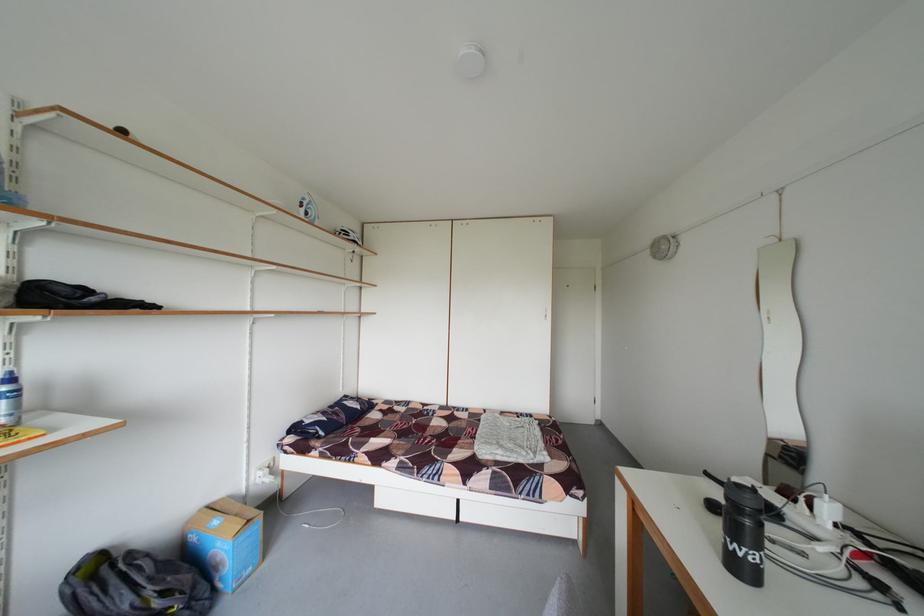
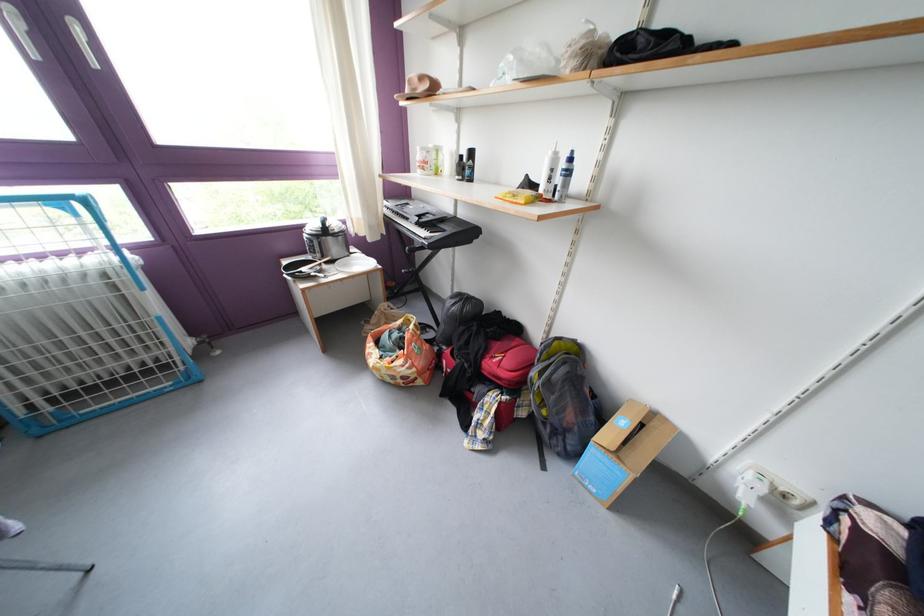
The point at (x=263, y=476) is marked in the first image. Where is the corresponding point in the second image?

(758, 467)